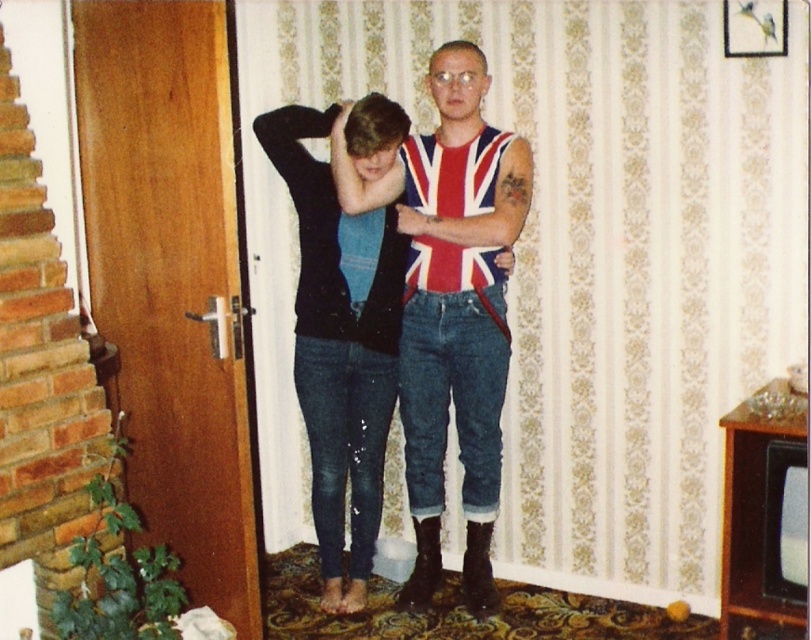
Question: Can you confirm if union jack fabric tank top at center is thinner than leather at lower center?

Choices:
 (A) no
 (B) yes

Answer: (A)

Question: Which object is closer to the camera taking this photo?

Choices:
 (A) black leather boot at lower center
 (B) union jack fabric at center

Answer: (B)

Question: Which point is closer to the camera?

Choices:
 (A) (423, 528)
 (B) (475, 536)
 (C) (299, 161)

Answer: (C)

Question: Which object appears closest to the camera in this image?

Choices:
 (A) union jack fabric tank top at center
 (B) black leather boot at lower center
 (C) union jack fabric at center
 (D) denim jeans at center

Answer: (D)

Question: Is union jack fabric tank top at center bigger than union jack fabric at center?

Choices:
 (A) yes
 (B) no

Answer: (A)

Question: Is denim jeans at center further to camera compared to black leather boot at lower center?

Choices:
 (A) yes
 (B) no

Answer: (B)